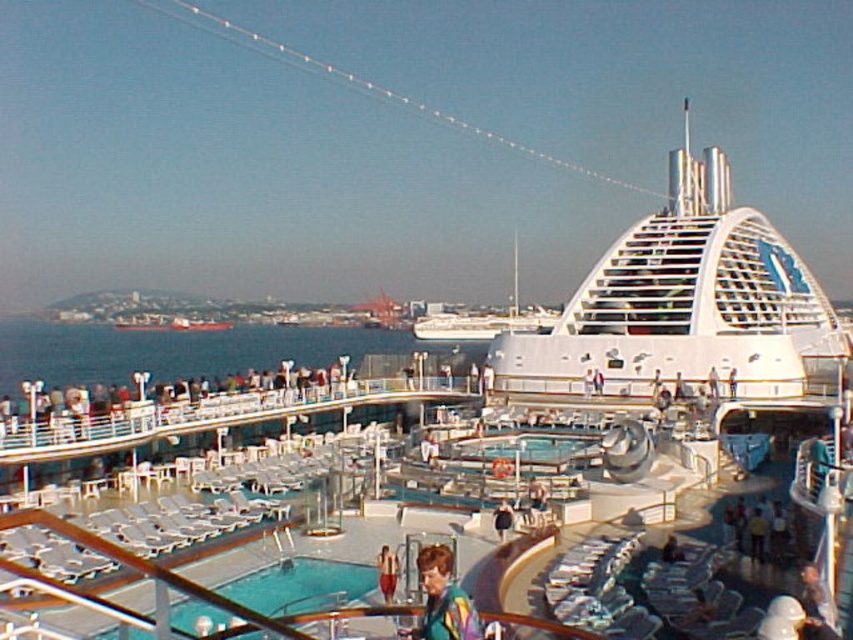
You are standing on the cruise ship deck and want to take a photo of both the point at coordinates point (x=397, y=577) and the point at coordinates point (x=506, y=515). Since one is closer to you, will you need to adjust your camera focus to capture both clearly?

Point (x=397, y=577) is closer to the camera than point (x=506, y=515). To capture both clearly, you may need to adjust the camera focus to account for the distance difference between the two points.

You are a photographer on the deck of a cruise ship and want to capture both the metallic gray ship at center and the smooth skin at center in a single shot. Given that your camera has a fixed focal length, which object should you position closer to the camera to ensure both fit in the frame?

Since the metallic gray ship at center is larger than the smooth skin at center, you should position the metallic gray ship at center closer to the camera. This way, its size in the frame will be balanced with the smaller smooth skin at center, allowing both to fit within the shot.

You are standing on the deck of the cruise ship and want to walk from your current position to the ship railing. There is a white glossy cruise ship at upper center and red fabric shorts at center in your way. Which object is closer to you so you can avoid it?

The red fabric shorts at center is closer to you than the white glossy cruise ship at upper center, so you should avoid the red fabric shorts at center first.